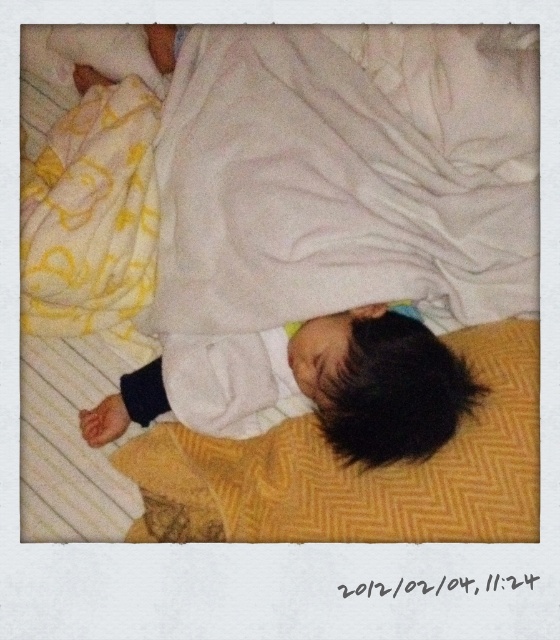
Question: Which point is farther to the camera?

Choices:
 (A) white soft baby at center
 (B) white soft blanket at upper center

Answer: (B)

Question: Can you confirm if white soft blanket at upper center is bigger than white soft baby at center?

Choices:
 (A) no
 (B) yes

Answer: (B)

Question: Does white soft blanket at upper center appear under white soft baby at center?

Choices:
 (A) no
 (B) yes

Answer: (A)

Question: Among these points, which one is nearest to the camera?

Choices:
 (A) (371, 401)
 (B) (338, 74)

Answer: (A)

Question: Is white soft blanket at upper center below white soft baby at center?

Choices:
 (A) no
 (B) yes

Answer: (A)